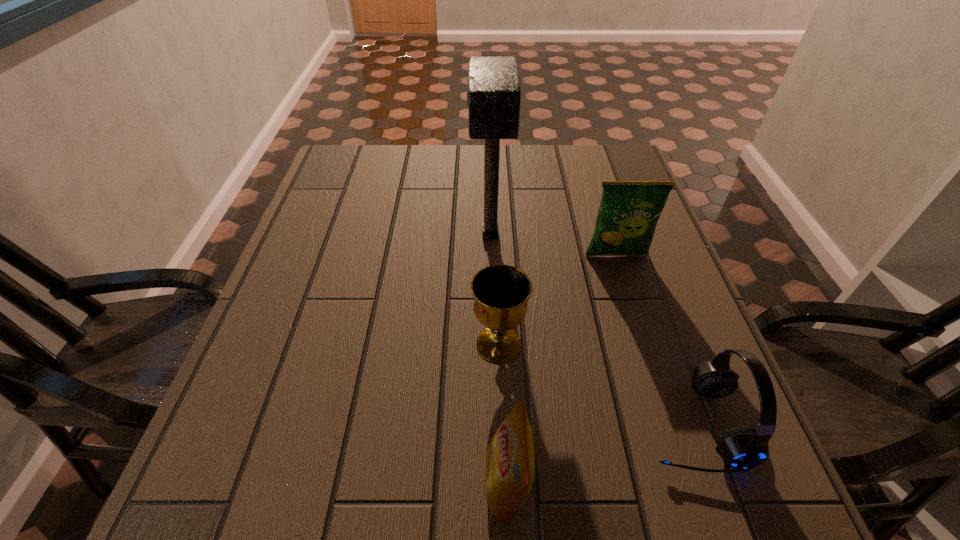
Where is `object that is at the near right corner`? object that is at the near right corner is located at coordinates (740, 447).

This screenshot has width=960, height=540. In order to click on vacant space at the far edge in this screenshot , I will do `click(548, 157)`.

Locate an element on the screen. blank space at the near edge is located at coordinates (407, 524).

The height and width of the screenshot is (540, 960). I want to click on vacant region at the left edge of the desktop, so click(x=321, y=320).

You are a GUI agent. You are given a task and a screenshot of the screen. Output one action in this format:
    pyautogui.click(x=<x>, y=<y>)
    Task: Click on the vacant space at the right edge of the desktop
    This screenshot has width=960, height=540.
    Given the screenshot: What is the action you would take?
    pyautogui.click(x=636, y=257)

The width and height of the screenshot is (960, 540). What are the coordinates of `vacant region at the far left corner` in the screenshot? It's located at (343, 171).

At what (x,y) coordinates should I click in order to perform the action: click on free location at the near left corner. Please return your answer as a coordinate pair (x, y). The image size is (960, 540). Looking at the image, I should click on [x=275, y=467].

At what (x,y) coordinates should I click in order to perform the action: click on vacant region at the far right corner of the desktop. Please return your answer as a coordinate pair (x, y). Looking at the image, I should click on (595, 151).

This screenshot has height=540, width=960. In order to click on free spot between the fourth shortest object and the third farthest object in this screenshot , I will do [x=558, y=300].

This screenshot has width=960, height=540. Identify the location of free space between the headset and the chalice. (595, 384).